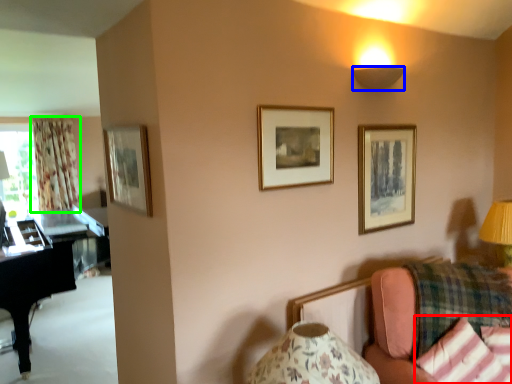
Question: Which is farther away from pillow (highlighted by a red box)? lamp (highlighted by a blue box) or curtain (highlighted by a green box)?

Choices:
 (A) lamp
 (B) curtain

Answer: (B)